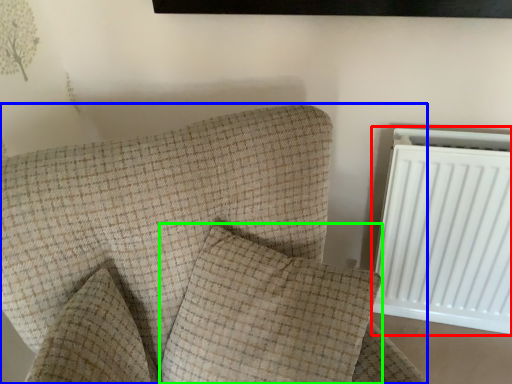
Question: Which object is positioned closest to radiator (highlighted by a red box)? Select from furniture (highlighted by a blue box) and pillow (highlighted by a green box).

Choices:
 (A) furniture
 (B) pillow

Answer: (B)